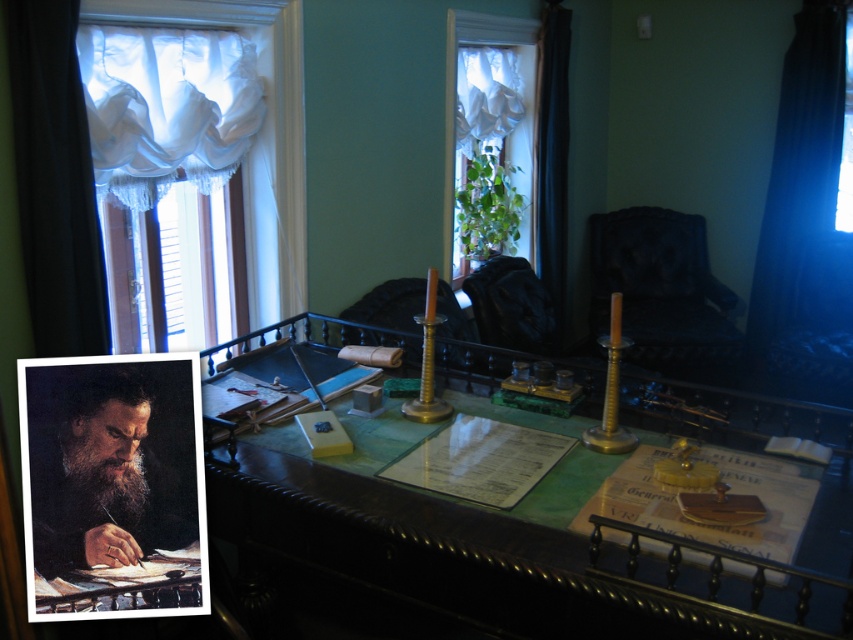
Question: Does black leather armchair at center come behind brown leather armchair at center?

Choices:
 (A) no
 (B) yes

Answer: (B)

Question: Estimate the real-world distances between objects in this image. Which object is farther from the transparent glass window at upper right?

Choices:
 (A) white fabric window at center
 (B) brown leather armchair at center
 (C) white lace curtain at upper left
 (D) black leather armchair at center

Answer: (C)

Question: Which object is positioned farthest from the white fabric window at center?

Choices:
 (A) transparent glass window at upper right
 (B) black fabric curtain at left

Answer: (A)

Question: Based on their relative distances, which object is farther from the black fabric curtain at right?

Choices:
 (A) dark blue fabric curtain at right
 (B) black leather armchair at center

Answer: (A)

Question: Does black fabric curtain at right appear under black leather armchair at center?

Choices:
 (A) no
 (B) yes

Answer: (A)

Question: Is black fabric curtain at left bigger than dark blue fabric curtain at right?

Choices:
 (A) yes
 (B) no

Answer: (B)